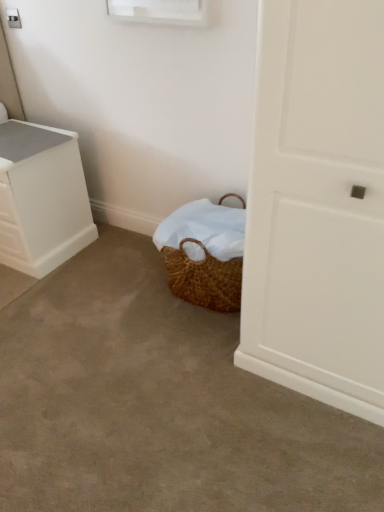
Question: Does brown woven basket at lower center have a larger size compared to white plastic chest of drawers at left?

Choices:
 (A) no
 (B) yes

Answer: (B)

Question: Is brown woven basket at lower center outside white plastic chest of drawers at left?

Choices:
 (A) no
 (B) yes

Answer: (B)

Question: From a real-world perspective, is brown woven basket at lower center below white plastic chest of drawers at left?

Choices:
 (A) no
 (B) yes

Answer: (B)

Question: From a real-world perspective, is brown woven basket at lower center physically above white plastic chest of drawers at left?

Choices:
 (A) no
 (B) yes

Answer: (A)

Question: Is white plastic chest of drawers at left completely or partially inside brown woven basket at lower center?

Choices:
 (A) no
 (B) yes

Answer: (A)

Question: Can you confirm if brown woven basket at lower center is taller than white plastic chest of drawers at left?

Choices:
 (A) no
 (B) yes

Answer: (A)

Question: Is white plastic chest of drawers at left thinner than brown woven basket at lower center?

Choices:
 (A) yes
 (B) no

Answer: (A)

Question: Is white plastic chest of drawers at left located outside brown woven basket at lower center?

Choices:
 (A) no
 (B) yes

Answer: (B)

Question: Considering the relative sizes of white plastic chest of drawers at left and brown woven basket at lower center in the image provided, is white plastic chest of drawers at left taller than brown woven basket at lower center?

Choices:
 (A) yes
 (B) no

Answer: (A)

Question: From a real-world perspective, is white plastic chest of drawers at left on top of brown woven basket at lower center?

Choices:
 (A) yes
 (B) no

Answer: (A)

Question: Can you confirm if white plastic chest of drawers at left is bigger than brown woven basket at lower center?

Choices:
 (A) no
 (B) yes

Answer: (A)

Question: Is white plastic chest of drawers at left positioned in front of brown woven basket at lower center?

Choices:
 (A) no
 (B) yes

Answer: (A)

Question: From a real-world perspective, is brown woven basket at lower center physically located above or below white plastic chest of drawers at left?

Choices:
 (A) below
 (B) above

Answer: (A)